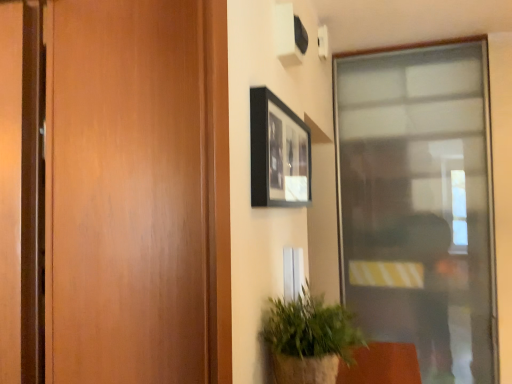
Question: Considering the relative sizes of transparent glass door at right and green textured plant at lower right in the image provided, is transparent glass door at right taller than green textured plant at lower right?

Choices:
 (A) no
 (B) yes

Answer: (B)

Question: Could you tell me if transparent glass door at right is facing green textured plant at lower right?

Choices:
 (A) no
 (B) yes

Answer: (B)

Question: Is transparent glass door at right far from green textured plant at lower right?

Choices:
 (A) yes
 (B) no

Answer: (A)

Question: Is the surface of transparent glass door at right in direct contact with green textured plant at lower right?

Choices:
 (A) no
 (B) yes

Answer: (A)

Question: Does transparent glass door at right appear on the left side of green textured plant at lower right?

Choices:
 (A) no
 (B) yes

Answer: (A)

Question: Does transparent glass door at right have a larger size compared to green textured plant at lower right?

Choices:
 (A) no
 (B) yes

Answer: (B)

Question: Is green textured plant at lower right located outside transparent glass door at right?

Choices:
 (A) no
 (B) yes

Answer: (B)

Question: Is green textured plant at lower right bigger than transparent glass door at right?

Choices:
 (A) no
 (B) yes

Answer: (A)

Question: Can you confirm if green textured plant at lower right is thinner than transparent glass door at right?

Choices:
 (A) yes
 (B) no

Answer: (B)

Question: Does green textured plant at lower right have a greater height compared to transparent glass door at right?

Choices:
 (A) yes
 (B) no

Answer: (B)

Question: Is green textured plant at lower right next to transparent glass door at right and touching it?

Choices:
 (A) yes
 (B) no

Answer: (B)

Question: Is green textured plant at lower right at the left side of transparent glass door at right?

Choices:
 (A) yes
 (B) no

Answer: (A)

Question: Can you confirm if black matte picture frame at upper center is bigger than transparent glass door at right?

Choices:
 (A) yes
 (B) no

Answer: (B)